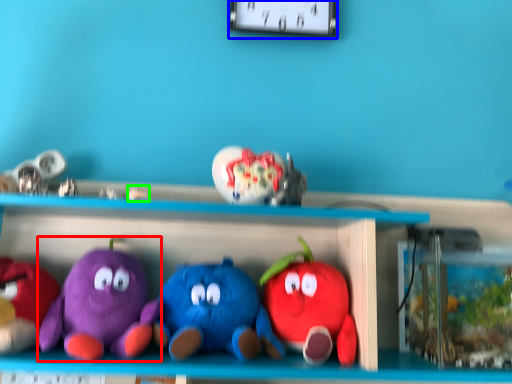
Question: Which object is positioned closest to toy (highlighted by a red box)? Select from clock (highlighted by a blue box) and toy (highlighted by a green box).

Choices:
 (A) clock
 (B) toy

Answer: (B)